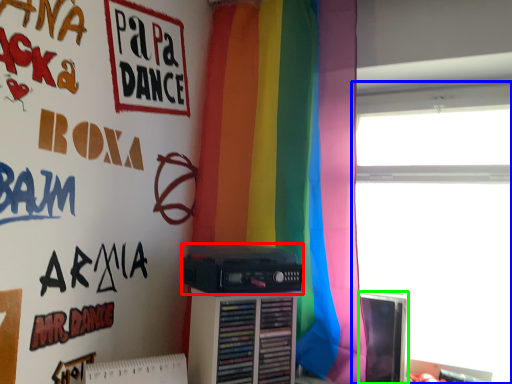
Question: Which object is the farthest from cassette (highlighted by a red box)? Choose among these: window (highlighted by a blue box) or computer monitor (highlighted by a green box).

Choices:
 (A) window
 (B) computer monitor

Answer: (A)